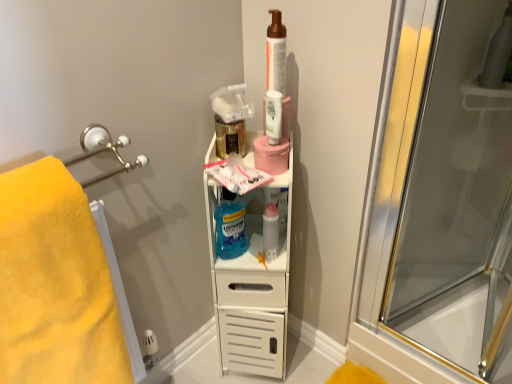
Question: Is yellow soft towel at left positioned far away from blue translucent liquid mouthwash at center?

Choices:
 (A) no
 (B) yes

Answer: (A)

Question: Is blue translucent liquid mouthwash at center located within yellow soft towel at left?

Choices:
 (A) no
 (B) yes

Answer: (A)

Question: Is yellow soft towel at left shorter than blue translucent liquid mouthwash at center?

Choices:
 (A) yes
 (B) no

Answer: (B)

Question: Is yellow soft towel at left at the right side of blue translucent liquid mouthwash at center?

Choices:
 (A) yes
 (B) no

Answer: (B)

Question: Does yellow soft towel at left turn towards blue translucent liquid mouthwash at center?

Choices:
 (A) no
 (B) yes

Answer: (A)

Question: In the image, is yellow soft towel at left on the left side or the right side of translucent plastic mouthwash at center, positioned as the second mouthwash in front-to-back order?

Choices:
 (A) right
 (B) left

Answer: (B)

Question: Is yellow soft towel at left wider or thinner than translucent plastic mouthwash at center, which is the first mouthwash from back to front?

Choices:
 (A) wide
 (B) thin

Answer: (A)

Question: From a real-world perspective, relative to translucent plastic mouthwash at center, which is the first mouthwash from back to front, is yellow soft towel at left vertically above or below?

Choices:
 (A) above
 (B) below

Answer: (B)

Question: Choose the correct answer: Is yellow soft towel at left inside translucent plastic mouthwash at center, which is the first mouthwash from back to front, or outside it?

Choices:
 (A) inside
 (B) outside

Answer: (B)

Question: In terms of height, does translucent plastic mouthwash at center, which is the first mouthwash from back to front, look taller or shorter compared to translucent plastic mouthwash at upper center, positioned as the 2th mouthwash in back-to-front order?

Choices:
 (A) short
 (B) tall

Answer: (B)

Question: From the image's perspective, is translucent plastic mouthwash at center, acting as the 1th mouthwash starting from the bottom, positioned above or below translucent plastic mouthwash at upper center, positioned as the 2th mouthwash in back-to-front order?

Choices:
 (A) below
 (B) above

Answer: (A)

Question: In terms of size, does translucent plastic mouthwash at center, arranged as the 2th mouthwash when viewed from the top, appear bigger or smaller than translucent plastic mouthwash at upper center, the first mouthwash viewed from the top?

Choices:
 (A) small
 (B) big

Answer: (B)

Question: In terms of width, does translucent plastic mouthwash at center, positioned as the second mouthwash in front-to-back order, look wider or thinner when compared to translucent plastic mouthwash at upper center, the first mouthwash viewed from the top?

Choices:
 (A) wide
 (B) thin

Answer: (A)

Question: Is matte brown pump bottle at upper center inside or outside of yellow soft towel at left?

Choices:
 (A) outside
 (B) inside

Answer: (A)

Question: Based on their sizes in the image, would you say matte brown pump bottle at upper center is bigger or smaller than yellow soft towel at left?

Choices:
 (A) small
 (B) big

Answer: (A)